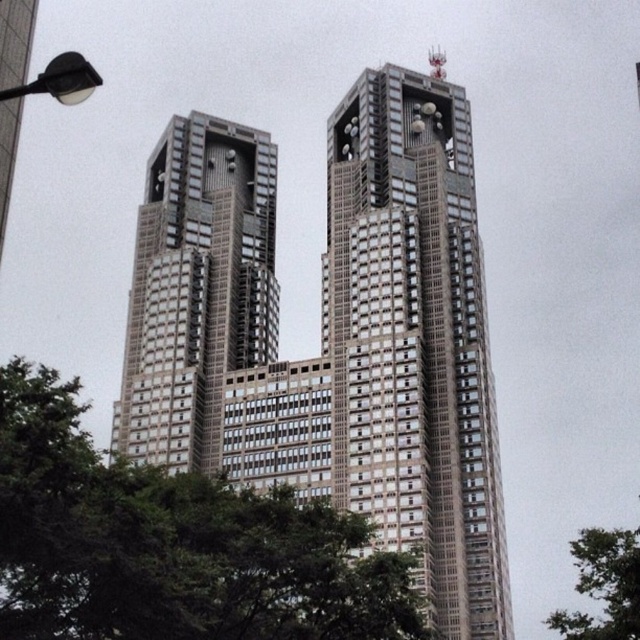
Question: Considering the relative positions of gray metallic building at center and metallic silver bell tower at center in the image provided, where is gray metallic building at center located with respect to metallic silver bell tower at center?

Choices:
 (A) below
 (B) above

Answer: (B)

Question: Where is gray metallic building at center located in relation to metallic silver bell tower at center in the image?

Choices:
 (A) below
 (B) above

Answer: (B)

Question: Which point is farther to the camera?

Choices:
 (A) metallic silver bell tower at center
 (B) green leafy tree at center
 (C) gray metallic building at center

Answer: (A)

Question: Which point is closer to the camera?

Choices:
 (A) (600, 580)
 (B) (145, 256)
 (C) (426, 326)

Answer: (A)

Question: Which of the following is the farthest from the observer?

Choices:
 (A) (68, 564)
 (B) (499, 548)
 (C) (582, 548)
 (D) (416, 140)

Answer: (D)

Question: Can you confirm if metallic silver bell tower at center is smaller than green leafy tree at lower right?

Choices:
 (A) no
 (B) yes

Answer: (B)